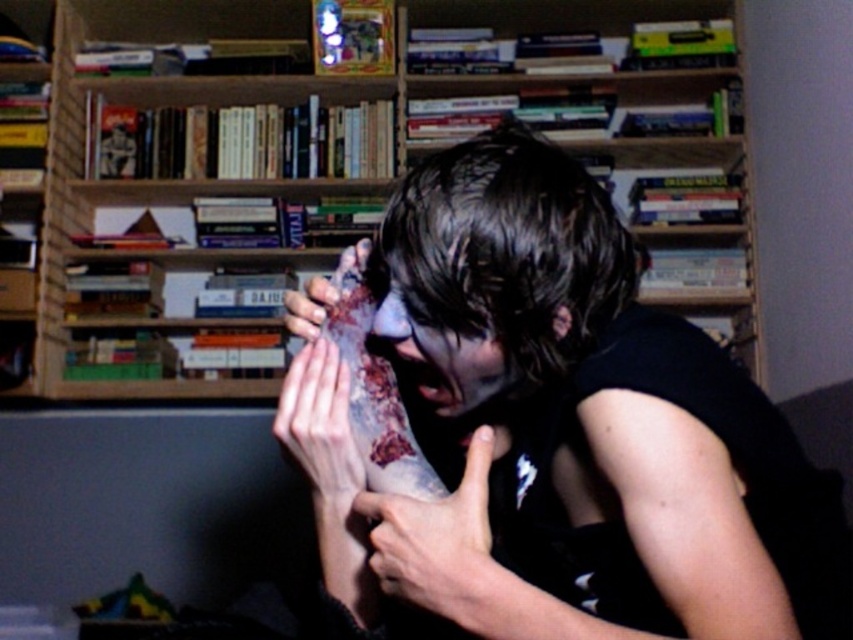
Looking at this image, you are a photographer standing 1 meter away from the camera. You want to take a portrait of the dark matte skin at center. Since the camera requires the subject to be at least 1.5 meters away to avoid distortion, will you need to move closer or farther away?

The dark matte skin at center is currently 54.33 centimeters away from the camera, which is closer than the required 1.5 meters. To avoid distortion, you need to move farther away until the subject is at least 1.5 meters from the camera.

You are a detective examining the scene. You need to determine if the smooth skin hand at center could have reached the top shelf of the wooden bookshelf at upper center without any assistance. Based on the size comparison between the two, can the hand reach the top shelf?

The wooden bookshelf at upper center is larger in size than the smooth skin hand at center, which suggests that the hand may not be able to reach the top shelf due to the bookshelf being taller or wider, but the exact height isn